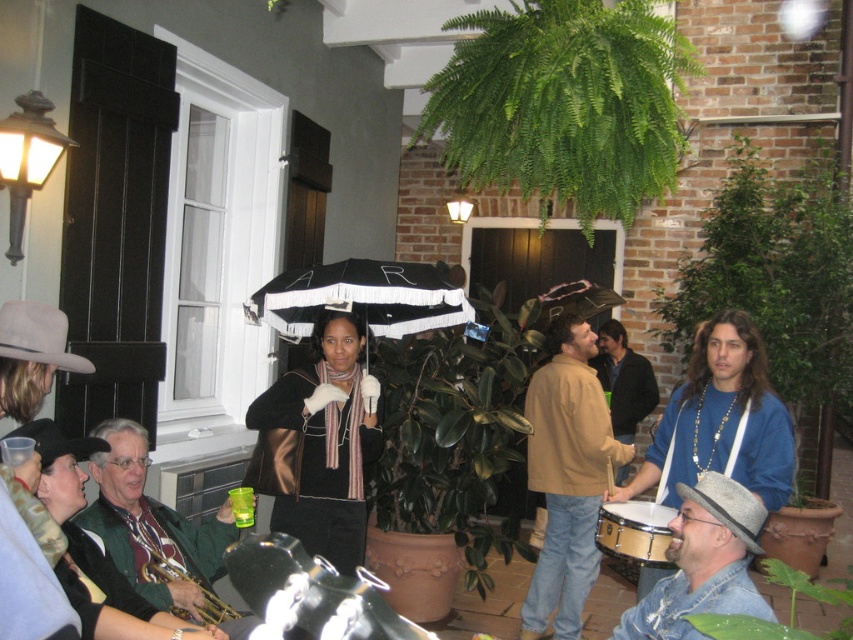
What do you see at coordinates (457, 435) in the screenshot? The image size is (853, 640). I see `green rubber plant at center` at bounding box center [457, 435].

You are a GUI agent. You are given a task and a screenshot of the screen. Output one action in this format:
    pyautogui.click(x=<x>, y=<y>)
    Task: Click on the green rubber plant at center
    
    Given the screenshot: What is the action you would take?
    pyautogui.click(x=457, y=435)

Can you confirm if green leafy plant at upper center is positioned to the left of green leafy plant at lower right?

Indeed, green leafy plant at upper center is positioned on the left side of green leafy plant at lower right.

Between green leafy plant at upper center and green leafy plant at lower right, which one appears on the right side from the viewer's perspective?

Positioned to the right is green leafy plant at lower right.

Where is `green leafy plant at upper center`? green leafy plant at upper center is located at coordinates (561, 104).

Measure the distance between green rubber plant at center and camera.

green rubber plant at center and camera are 14.08 feet apart.

Identify the location of green rubber plant at center. (457, 435).